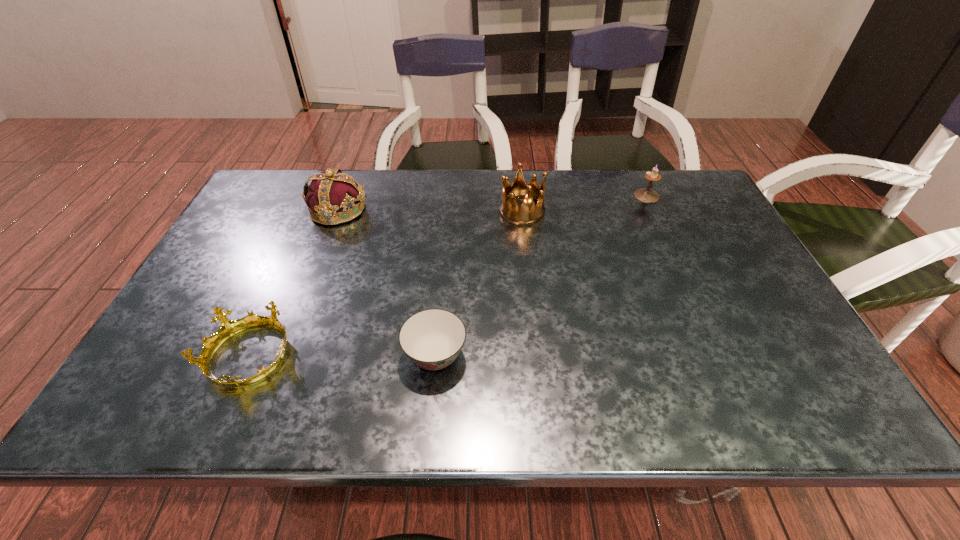
Locate an element on the screen. vacant area at the far right corner is located at coordinates (670, 202).

At what (x,y) coordinates should I click in order to perform the action: click on blank region between the nearest crown and the soup bowl. Please return your answer as a coordinate pair (x, y). The image size is (960, 540). Looking at the image, I should click on tap(343, 356).

The width and height of the screenshot is (960, 540). Identify the location of free point between the shortest crown and the rightmost object. (448, 276).

Find the location of `empty space between the rightmost object and the fourth object from left to right`. empty space between the rightmost object and the fourth object from left to right is located at coordinates (585, 204).

In order to click on free space between the second object from right to left and the rightmost object in this screenshot , I will do `click(585, 204)`.

Identify the location of empty space that is in between the third object from right to left and the shortest crown. Image resolution: width=960 pixels, height=540 pixels. (343, 356).

This screenshot has width=960, height=540. I want to click on vacant space that's between the soup bowl and the second object from right to left, so click(478, 284).

Image resolution: width=960 pixels, height=540 pixels. Find the location of `vacant space that's between the nearest crown and the rightmost crown`. vacant space that's between the nearest crown and the rightmost crown is located at coordinates (386, 284).

Locate which object is the third closest to the third object from right to left. Please provide its 2D coordinates. Your answer should be formatted as a tuple, i.e. [(x, y)], where the tuple contains the x and y coordinates of a point satisfying the conditions above.

[(331, 198)]

Point out which object is positioned as the second nearest to the rightmost crown. Please provide its 2D coordinates. Your answer should be formatted as a tuple, i.e. [(x, y)], where the tuple contains the x and y coordinates of a point satisfying the conditions above.

[(331, 198)]